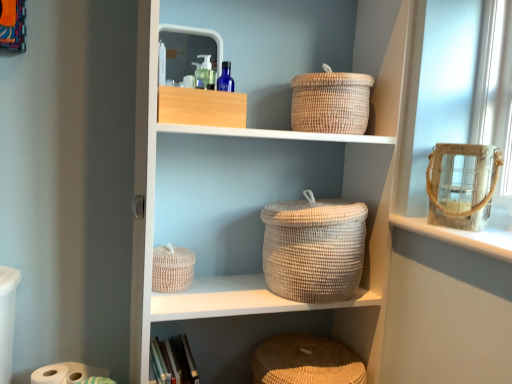
Question: Does white matte toilet paper at lower left have a greater height compared to white woven basket at center?

Choices:
 (A) no
 (B) yes

Answer: (A)

Question: From a real-world perspective, is white matte toilet paper at lower left physically above white woven basket at center?

Choices:
 (A) yes
 (B) no

Answer: (B)

Question: Does white matte toilet paper at lower left lie in front of white woven basket at center?

Choices:
 (A) no
 (B) yes

Answer: (A)

Question: Considering the relative positions of white matte toilet paper at lower left and white woven basket at center in the image provided, is white matte toilet paper at lower left to the right of white woven basket at center from the viewer's perspective?

Choices:
 (A) yes
 (B) no

Answer: (B)

Question: Would you say white matte toilet paper at lower left is outside white woven basket at center?

Choices:
 (A) no
 (B) yes

Answer: (B)

Question: Considering the relative sizes of white matte toilet paper at lower left and white woven basket at center in the image provided, is white matte toilet paper at lower left thinner than white woven basket at center?

Choices:
 (A) yes
 (B) no

Answer: (A)

Question: Can you confirm if natural woven baskets at center is thinner than orange fabric picture frame at upper left?

Choices:
 (A) no
 (B) yes

Answer: (A)

Question: Can you confirm if natural woven baskets at center is positioned to the right of orange fabric picture frame at upper left?

Choices:
 (A) yes
 (B) no

Answer: (A)

Question: Can you confirm if natural woven baskets at center is shorter than orange fabric picture frame at upper left?

Choices:
 (A) no
 (B) yes

Answer: (A)

Question: Considering the relative sizes of natural woven baskets at center and orange fabric picture frame at upper left in the image provided, is natural woven baskets at center smaller than orange fabric picture frame at upper left?

Choices:
 (A) yes
 (B) no

Answer: (B)

Question: From a real-world perspective, is natural woven baskets at center below orange fabric picture frame at upper left?

Choices:
 (A) no
 (B) yes

Answer: (B)

Question: Is natural woven baskets at center bigger than orange fabric picture frame at upper left?

Choices:
 (A) no
 (B) yes

Answer: (B)

Question: Does natural woven basket at lower center, which appears as the 3th basket when viewed from the top, have a lesser height compared to orange fabric picture frame at upper left?

Choices:
 (A) no
 (B) yes

Answer: (B)